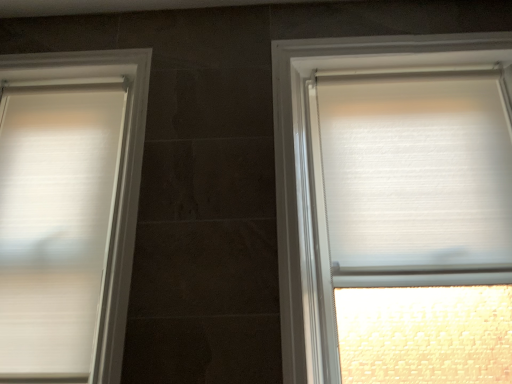
Question: In the image, is white textured blind at right positioned in front of or behind white textured roller blind at right, which is the 1th window in right-to-left order?

Choices:
 (A) front
 (B) behind

Answer: (B)

Question: In terms of width, does white textured blind at right look wider or thinner when compared to white textured roller blind at right, which is the 1th window in right-to-left order?

Choices:
 (A) thin
 (B) wide

Answer: (A)

Question: Which object is positioned farthest from the white matte blinds at left, acting as the 1th window starting from the left?

Choices:
 (A) white textured blind at right
 (B) white textured roller blind at right, which is the 1th window in right-to-left order

Answer: (A)

Question: Which is nearer to the white textured roller blind at right, which is the 1th window in right-to-left order?

Choices:
 (A) white textured blind at right
 (B) white matte blinds at left, acting as the 1th window starting from the left

Answer: (A)